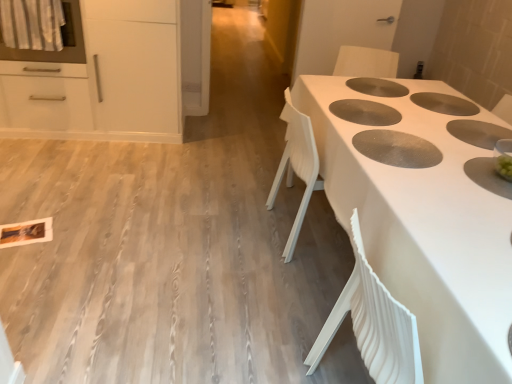
At what (x,y) coordinates should I click in order to perform the action: click on free space to the right of white matte cabinet at upper left. Please return your answer as a coordinate pair (x, y). The height and width of the screenshot is (384, 512). Looking at the image, I should click on (208, 148).